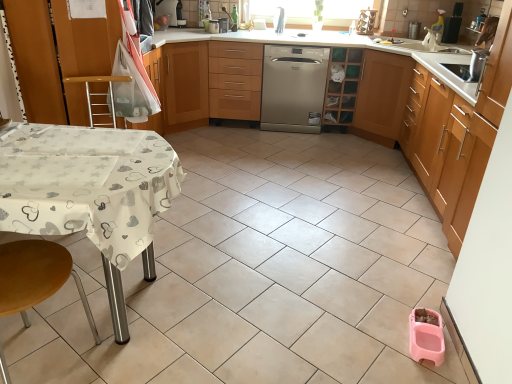
Question: Considering the relative sizes of wooden cabinet at center, arranged as the 2th cabinetry when viewed from the right, and wooden/metallic step stool at left, marked as the second step stool in a bottom-to-top arrangement, in the image provided, is wooden cabinet at center, arranged as the 2th cabinetry when viewed from the right, shorter than wooden/metallic step stool at left, marked as the second step stool in a bottom-to-top arrangement,?

Choices:
 (A) no
 (B) yes

Answer: (A)

Question: Is wooden cabinet at center, the 3th cabinetry when ordered from left to right, behind wooden/metallic step stool at left, which is counted as the 1th step stool, starting from the back?

Choices:
 (A) no
 (B) yes

Answer: (B)

Question: Is wooden cabinet at center, the 3th cabinetry when ordered from left to right, bigger than wooden/metallic step stool at left, marked as the second step stool in a bottom-to-top arrangement?

Choices:
 (A) yes
 (B) no

Answer: (A)

Question: Does wooden cabinet at center, the 3th cabinetry when ordered from left to right, have a smaller size compared to wooden/metallic step stool at left, acting as the second step stool starting from the front?

Choices:
 (A) yes
 (B) no

Answer: (B)

Question: Is wooden cabinet at center, arranged as the 2th cabinetry when viewed from the right, closer to the viewer compared to wooden/metallic step stool at left, which ranks as the 1th step stool in top-to-bottom order?

Choices:
 (A) yes
 (B) no

Answer: (B)

Question: Is wooden cabinet at center, the 3th cabinetry when ordered from left to right, with wooden/metallic step stool at left, marked as the second step stool in a bottom-to-top arrangement?

Choices:
 (A) yes
 (B) no

Answer: (B)

Question: From the image's perspective, is white glossy table at left, the 4th cabinetry from the right, below wooden step stool at lower left, placed as the 1th step stool when sorted from bottom to top?

Choices:
 (A) yes
 (B) no

Answer: (B)

Question: From the image's perspective, is white glossy table at left, the 4th cabinetry from the right, located above wooden step stool at lower left, the second step stool from the back?

Choices:
 (A) yes
 (B) no

Answer: (A)

Question: Is wooden step stool at lower left, placed as the first step stool when sorted from front to back, completely or partially inside white glossy table at left, the 4th cabinetry from the right?

Choices:
 (A) no
 (B) yes

Answer: (A)

Question: Can you confirm if white glossy table at left, placed as the 1th cabinetry when sorted from left to right, is wider than wooden step stool at lower left, the second step stool from the back?

Choices:
 (A) no
 (B) yes

Answer: (B)

Question: Does white glossy table at left, placed as the 1th cabinetry when sorted from left to right, have a lesser width compared to wooden step stool at lower left, placed as the first step stool when sorted from front to back?

Choices:
 (A) no
 (B) yes

Answer: (A)

Question: Is white glossy table at left, the 4th cabinetry from the right, taller than wooden step stool at lower left, placed as the first step stool when sorted from front to back?

Choices:
 (A) yes
 (B) no

Answer: (A)

Question: Is wooden step stool at lower left, placed as the 1th step stool when sorted from bottom to top, shorter than white fabric-covered table at lower left?

Choices:
 (A) no
 (B) yes

Answer: (A)